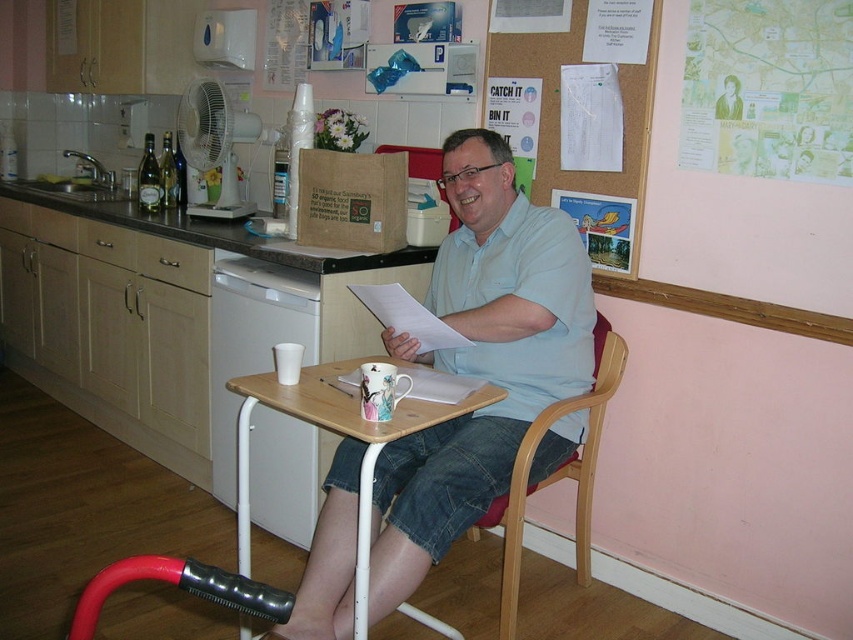
Is light blue cotton shirt at center taller than wooden chair at center?

Yes, light blue cotton shirt at center is taller than wooden chair at center.

Locate an element on the screen. The width and height of the screenshot is (853, 640). light blue cotton shirt at center is located at coordinates (480, 360).

Is point (337, 486) closer to viewer compared to point (363, 576)?

That is False.

Image resolution: width=853 pixels, height=640 pixels. What are the coordinates of `light blue cotton shirt at center` in the screenshot? It's located at [480, 360].

Can you confirm if light blue cotton shirt at center is thinner than corkboard at upper center?

Yes.

Who is positioned more to the left, light blue cotton shirt at center or corkboard at upper center?

light blue cotton shirt at center is more to the left.

Identify the location of light blue cotton shirt at center. The width and height of the screenshot is (853, 640). (480, 360).